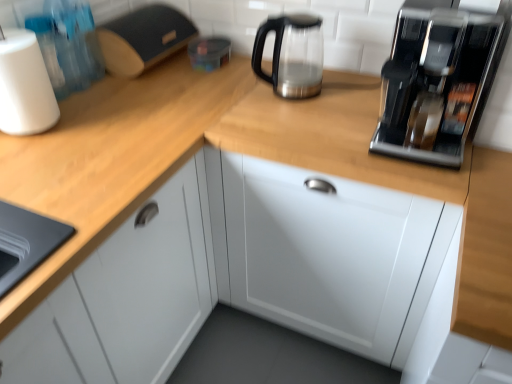
Locate an element on the screen. This screenshot has height=384, width=512. vacant space situated on the left part of sleek metallic coffee machine at upper right is located at coordinates (327, 127).